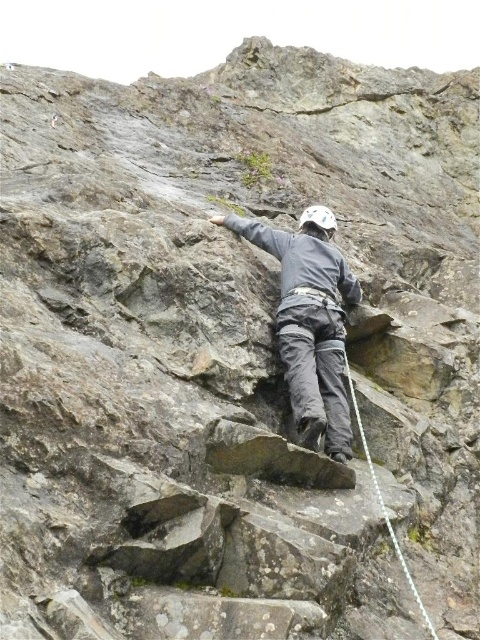
You are a photographer positioned at the base of the cliff. You want to capture a shot of the gray fabric climbing suit at center without the white nylon rope at center appearing in the foreground. Is this possible based on their positions?

The white nylon rope at center is behind the gray fabric climbing suit at center, so yes, it will not appear in the foreground. The photographer can capture the gray fabric climbing suit at center without the rope obstructing it in the foreground.

You are a safety inspector assessing the setup of the rock climber. The gray fabric climbing suit at center must be secured with the white nylon rope at center. Based on their widths, can the rope safely secure the suit?

The gray fabric climbing suit at center might be wider than the white nylon rope at center, so the rope may not be wide enough to securely fasten around the suit. A wider rope is recommended for proper safety.

You are a photographer positioned at the base of the cliff capturing the climber. Which of the two points, point (x=342, y=435) or point (x=391, y=540), appears closer to you in the photo?

Point (x=342, y=435) is further to the camera than point (x=391, y=540), so point (x=391, y=540) appears closer to you in the photo.